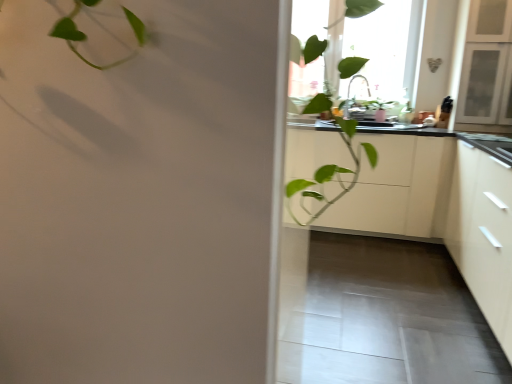
Question: Does white matte cabinet at right, the second cabinetry viewed from the back, have a greater width compared to transparent glass window at upper center?

Choices:
 (A) yes
 (B) no

Answer: (A)

Question: From a real-world perspective, is white matte cabinet at right, the 1th cabinetry in the front-to-back sequence, below transparent glass window at upper center?

Choices:
 (A) yes
 (B) no

Answer: (A)

Question: From the image's perspective, is white matte cabinet at right, the second cabinetry viewed from the back, located above transparent glass window at upper center?

Choices:
 (A) no
 (B) yes

Answer: (A)

Question: Is white matte cabinet at right, the second cabinetry viewed from the back, located outside transparent glass window at upper center?

Choices:
 (A) no
 (B) yes

Answer: (B)

Question: Are white matte cabinet at right, the second cabinetry viewed from the back, and transparent glass window at upper center beside each other?

Choices:
 (A) no
 (B) yes

Answer: (A)

Question: In terms of size, does transparent glass window at upper center appear bigger or smaller than white matte cabinet at right, the second cabinetry viewed from the back?

Choices:
 (A) small
 (B) big

Answer: (A)

Question: Is transparent glass window at upper center in front of or behind white matte cabinet at right, the second cabinetry viewed from the back, in the image?

Choices:
 (A) behind
 (B) front

Answer: (A)

Question: Is transparent glass window at upper center spatially inside white matte cabinet at right, the 1th cabinetry in the front-to-back sequence, or outside of it?

Choices:
 (A) inside
 (B) outside

Answer: (B)

Question: Is point (384, 74) positioned closer to the camera than point (496, 238)?

Choices:
 (A) farther
 (B) closer

Answer: (A)

Question: From the image's perspective, is transparent glass window at upper center located above or below white matte cabinet at center, the 2th cabinetry when ordered from front to back?

Choices:
 (A) below
 (B) above

Answer: (B)

Question: From a real-world perspective, relative to white matte cabinet at center, the 2th cabinetry when ordered from front to back, is transparent glass window at upper center vertically above or below?

Choices:
 (A) above
 (B) below

Answer: (A)

Question: Is point (356, 44) positioned closer to the camera than point (403, 208)?

Choices:
 (A) closer
 (B) farther

Answer: (B)

Question: Considering the positions of transparent glass window at upper center and white matte cabinet at center, the first cabinetry in the back-to-front sequence, in the image, is transparent glass window at upper center taller or shorter than white matte cabinet at center, the first cabinetry in the back-to-front sequence,?

Choices:
 (A) tall
 (B) short

Answer: (A)

Question: Considering the relative positions of transparent glass window at upper center and black matte countertop at center in the image provided, is transparent glass window at upper center to the left or to the right of black matte countertop at center?

Choices:
 (A) left
 (B) right

Answer: (A)

Question: Is transparent glass window at upper center taller or shorter than black matte countertop at center?

Choices:
 (A) tall
 (B) short

Answer: (A)